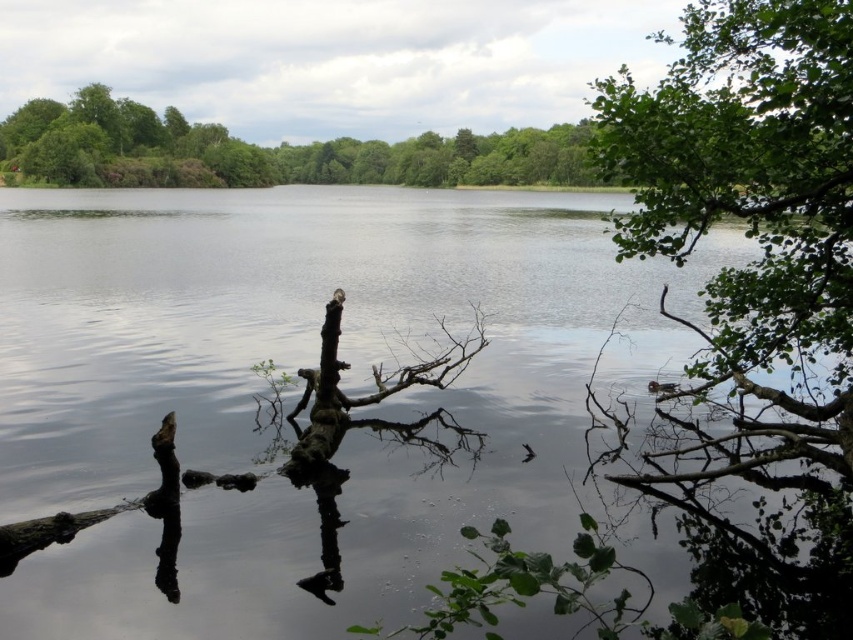
Is point (436, 134) positioned before point (317, 444)?

That is False.

Does green leafy trees at upper center have a greater width compared to brown rough branch at center?

Indeed, green leafy trees at upper center has a greater width compared to brown rough branch at center.

Who is more distant from viewer, (500, 176) or (300, 474)?

The point (500, 176) is behind.

In order to click on green leafy trees at upper center in this screenshot , I will do `click(265, 150)`.

Is transparent water at center closer to camera compared to brown rough branch at center?

Answer: Yes, it is in front of brown rough branch at center.

Who is shorter, transparent water at center or brown rough branch at center?

Standing shorter between the two is brown rough branch at center.

At what (x,y) coordinates should I click in order to perform the action: click on transparent water at center. Please return your answer as a coordinate pair (x, y). The image size is (853, 640). Looking at the image, I should click on (296, 378).

Where is `transparent water at center`? The height and width of the screenshot is (640, 853). transparent water at center is located at coordinates (296, 378).

Does transparent water at center come in front of green leafy trees at upper center?

Yes, it is in front of green leafy trees at upper center.

Does point (6, 387) come behind point (103, 145)?

No, it is not.

Locate an element on the screen. This screenshot has width=853, height=640. transparent water at center is located at coordinates (296, 378).